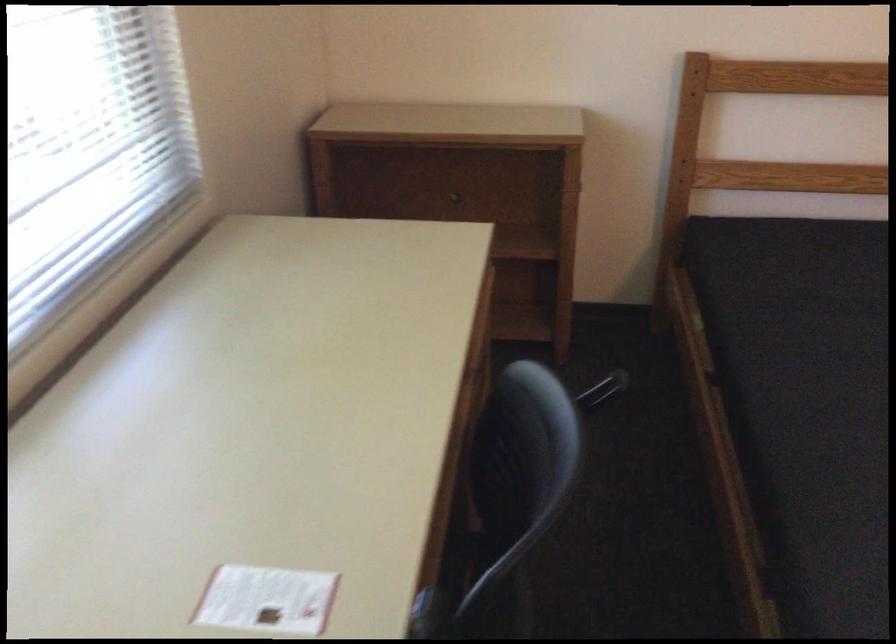
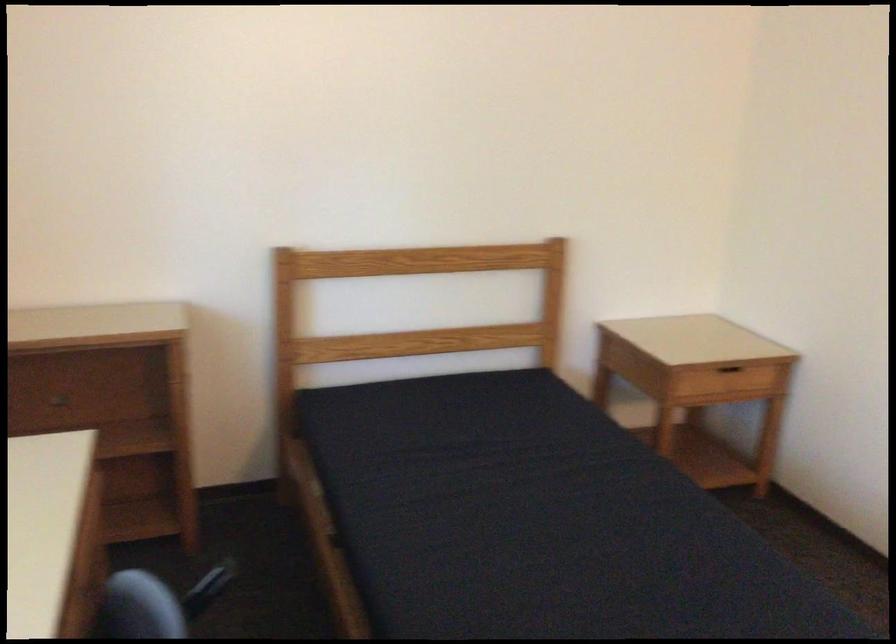
In a continuous first-person perspective shot, in which direction is the camera moving?

The cameraman walked toward right, backward.